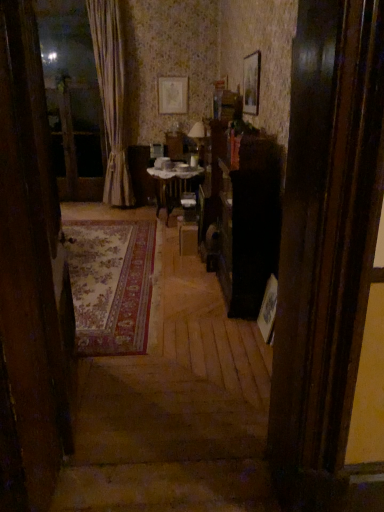
Question: From a real-world perspective, is wooden picture frame at upper center, the second picture frame from the top, positioned above or below silky beige curtain at left?

Choices:
 (A) below
 (B) above

Answer: (B)

Question: Is wooden picture frame at upper center, which is the second picture frame from left to right, to the left or to the right of silky beige curtain at left in the image?

Choices:
 (A) left
 (B) right

Answer: (B)

Question: Which is nearer to the wooden picture frame at upper center, which ranks as the 1th picture frame in bottom-to-top order?

Choices:
 (A) silky beige curtain at left
 (B) carpeted rug at left
 (C) wooden table at center
 (D) matte paper picture frame at upper center, which is the 1th picture frame from top to bottom

Answer: (C)

Question: Estimate the real-world distances between objects in this image. Which object is closer to the matte paper picture frame at upper center, which is the second picture frame in right-to-left order?

Choices:
 (A) wooden table at center
 (B) silky beige curtain at left
 (C) carpeted rug at left
 (D) wooden picture frame at upper center, the 1th picture frame from the right

Answer: (B)